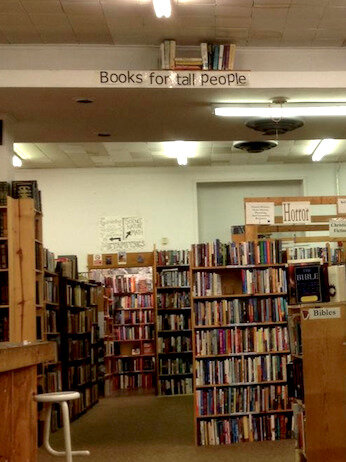
Find the location of a particular element. The width and height of the screenshot is (346, 462). area to sit is located at coordinates (54, 393).